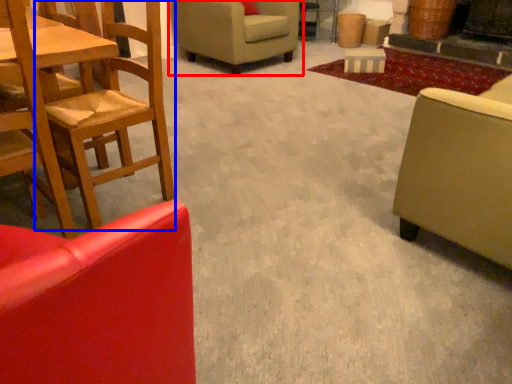
Question: Which point is closer to the camera, chair (highlighted by a red box) or chair (highlighted by a blue box)?

Choices:
 (A) chair
 (B) chair

Answer: (B)